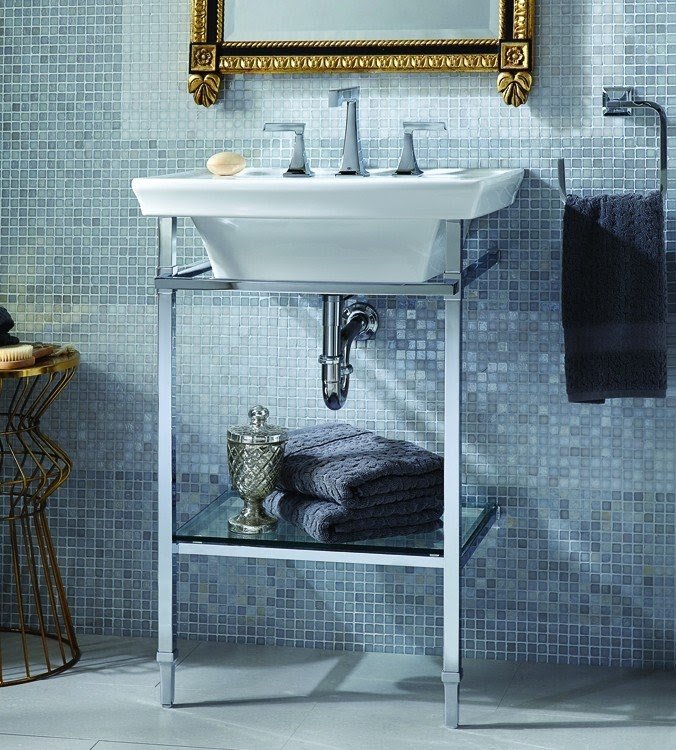
Where is `cup`? The width and height of the screenshot is (676, 750). cup is located at coordinates (268, 446).